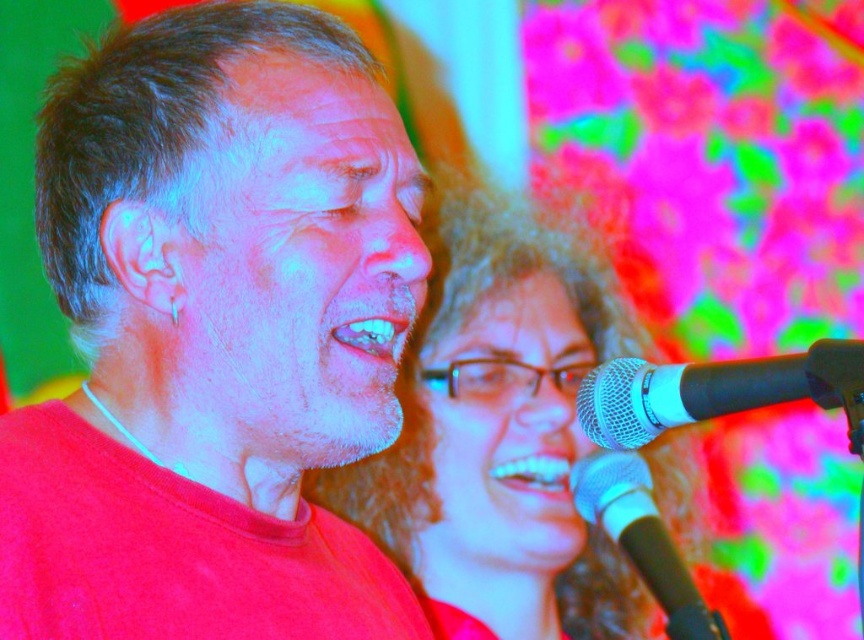
Question: Does matte plastic hair at center have a greater width compared to white glossy teeth at center?

Choices:
 (A) no
 (B) yes

Answer: (B)

Question: Does black metallic microphone at lower right appear under smooth glossy teeth at center?

Choices:
 (A) yes
 (B) no

Answer: (A)

Question: Is matte plastic hair at center above white glossy teeth at center?

Choices:
 (A) no
 (B) yes

Answer: (B)

Question: Which point is closer to the camera?

Choices:
 (A) matte plastic hair at center
 (B) black metallic microphone at lower right

Answer: (B)

Question: Which of the following is the farthest from the observer?

Choices:
 (A) smooth glossy teeth at center
 (B) black metallic microphone at lower right
 (C) matte plastic hair at center

Answer: (C)

Question: Estimate the real-world distances between objects in this image. Which object is closer to the black matte microphone at lower right?

Choices:
 (A) white glossy teeth at center
 (B) black metallic microphone at lower right
 (C) matte red shirt at center
 (D) smooth glossy teeth at center

Answer: (D)